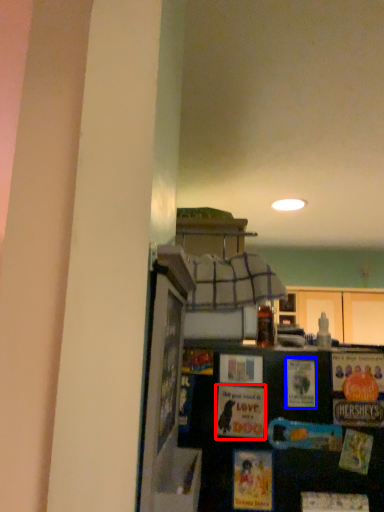
Question: Which object appears farthest to the camera in this image, postcard (highlighted by a red box) or postcard (highlighted by a blue box)?

Choices:
 (A) postcard
 (B) postcard

Answer: (B)